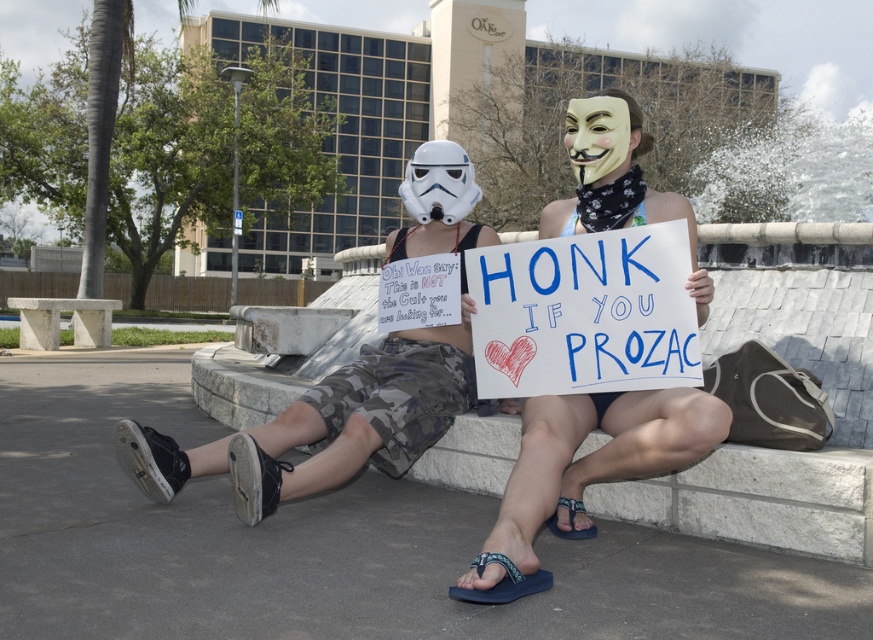
What is the exact coordinate of the camouflage shorts at center?

The camouflage shorts at center is located at point (x=583, y=470).

You are a photographer standing at the camera position. You want to take a closeup photo of the point at coordinate (x=675, y=419). The camera has a focal length of 50mm. What is the minimum distance in feet you need to move forward to focus on that point?

The point at coordinate (x=675, y=419) is 9.87 feet away from the camera. To focus on this point, the photographer must be at least 9.87 feet away from the point, so they need to move forward to that distance. However, since the camera is already at the current position, the photographer doesn not need to move forward. The minimum distance required is 9.87 feet, so they should ensure they are exactly at that distance.